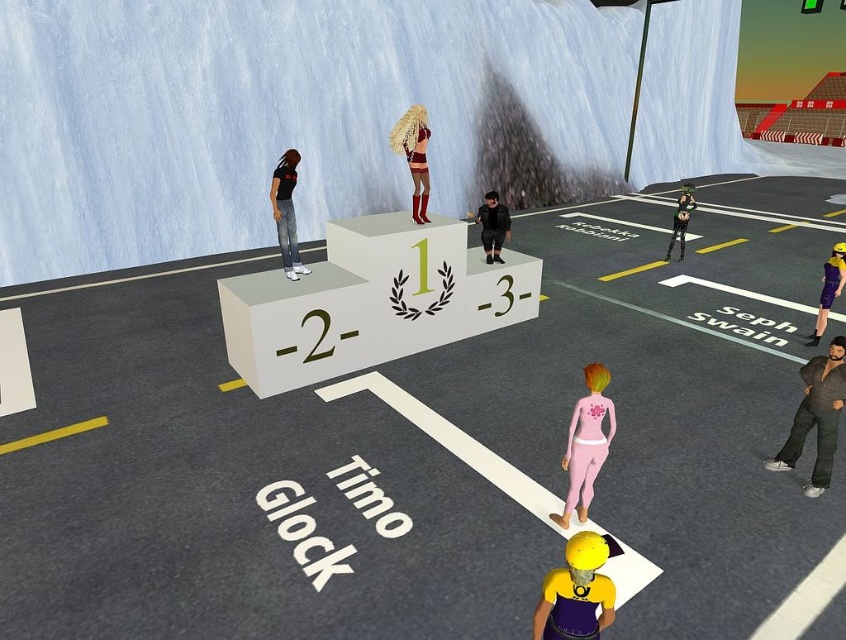
Is yellow matte helmet at center further to the viewer compared to black matte shirt at center?

No, yellow matte helmet at center is in front of black matte shirt at center.

Measure the distance between point (580, 584) and camera.

The distance of point (580, 584) from camera is 2.96 meters.

Which is in front, point (584, 628) or point (273, 216)?

Point (584, 628)

Find the location of a particular element. yellow matte helmet at center is located at coordinates (575, 593).

Can you confirm if yellow matte helmet at center is positioned to the right of pink matte/skinny at center?

In fact, yellow matte helmet at center is to the left of pink matte/skinny at center.

At what (x,y) coordinates should I click in order to perform the action: click on yellow matte helmet at center. Please return your answer as a coordinate pair (x, y). This screenshot has height=640, width=846. Looking at the image, I should click on (575, 593).

What are the coordinates of `yellow matte helmet at center` in the screenshot? It's located at (575, 593).

Between point (580, 417) and point (682, 220), which one is positioned behind?

The point (682, 220) is behind.

Which is more to the left, pink matte/skinny at center or green metallic helmet at upper center?

From the viewer's perspective, pink matte/skinny at center appears more on the left side.

Is point (602, 388) farther from camera compared to point (684, 195)?

No, (602, 388) is closer to viewer.

At what (x,y) coordinates should I click in order to perform the action: click on pink matte/skinny at center. Please return your answer as a coordinate pair (x, y). The height and width of the screenshot is (640, 846). Looking at the image, I should click on (586, 444).